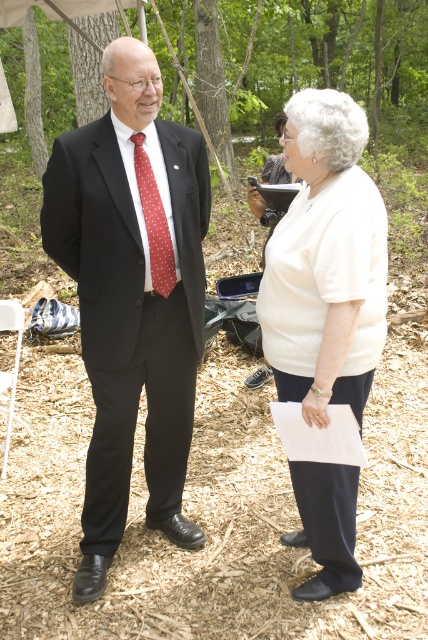
Question: From the image, what is the correct spatial relationship of matte black suit at left in relation to red dotted fabric tie at center?

Choices:
 (A) left
 (B) right

Answer: (A)

Question: Which of these objects is positioned closest to the white cotton shirt at center?

Choices:
 (A) matte black suit at left
 (B) red dotted fabric tie at center

Answer: (B)

Question: Which is farther from the matte black suit at left?

Choices:
 (A) white cotton shirt at center
 (B) matte black suit at center
 (C) red dotted fabric tie at center

Answer: (A)

Question: Which point appears farthest from the camera in this image?

Choices:
 (A) (91, 163)
 (B) (299, 243)
 (C) (335, 131)

Answer: (A)

Question: Can you confirm if matte black suit at left is thinner than red dotted fabric tie at center?

Choices:
 (A) no
 (B) yes

Answer: (A)

Question: Is the position of matte black suit at left more distant than that of red dotted fabric tie at center?

Choices:
 (A) yes
 (B) no

Answer: (B)